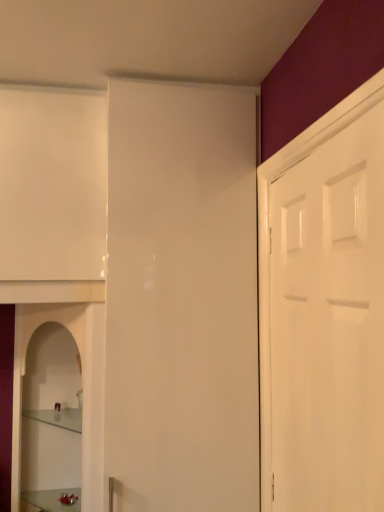
Question: Is white glossy door at right directly adjacent to clear glass shelf at lower left?

Choices:
 (A) yes
 (B) no

Answer: (B)

Question: Is white glossy door at right completely or partially outside of clear glass shelf at lower left?

Choices:
 (A) no
 (B) yes

Answer: (B)

Question: Is white glossy door at right thinner than clear glass shelf at lower left?

Choices:
 (A) no
 (B) yes

Answer: (B)

Question: Is white glossy door at right at the right side of clear glass shelf at lower left?

Choices:
 (A) yes
 (B) no

Answer: (A)

Question: Is white glossy door at right positioned far away from clear glass shelf at lower left?

Choices:
 (A) yes
 (B) no

Answer: (A)

Question: Is metallic silver tray at lower left in front of or behind clear glass cabinet at lower left in the image?

Choices:
 (A) front
 (B) behind

Answer: (B)

Question: Looking at their shapes, would you say metallic silver tray at lower left is wider or thinner than clear glass cabinet at lower left?

Choices:
 (A) wide
 (B) thin

Answer: (B)

Question: From a real-world perspective, is metallic silver tray at lower left physically located above or below clear glass cabinet at lower left?

Choices:
 (A) above
 (B) below

Answer: (B)

Question: Considering the relative positions of metallic silver tray at lower left and clear glass cabinet at lower left in the image provided, is metallic silver tray at lower left to the left or to the right of clear glass cabinet at lower left?

Choices:
 (A) left
 (B) right

Answer: (B)

Question: Considering the positions of metallic silver tray at lower left and white glossy door at right in the image, is metallic silver tray at lower left wider or thinner than white glossy door at right?

Choices:
 (A) wide
 (B) thin

Answer: (A)

Question: From the image's perspective, is metallic silver tray at lower left above or below white glossy door at right?

Choices:
 (A) above
 (B) below

Answer: (B)

Question: Visually, is metallic silver tray at lower left positioned to the left or to the right of white glossy door at right?

Choices:
 (A) right
 (B) left

Answer: (B)

Question: Is point (66, 490) closer or farther from the camera than point (334, 284)?

Choices:
 (A) farther
 (B) closer

Answer: (A)

Question: Is point (82, 368) positioned closer to the camera than point (61, 414)?

Choices:
 (A) closer
 (B) farther

Answer: (A)

Question: From the image's perspective, relative to clear glass shelf at lower left, is clear glass cabinet at lower left above or below?

Choices:
 (A) below
 (B) above

Answer: (B)